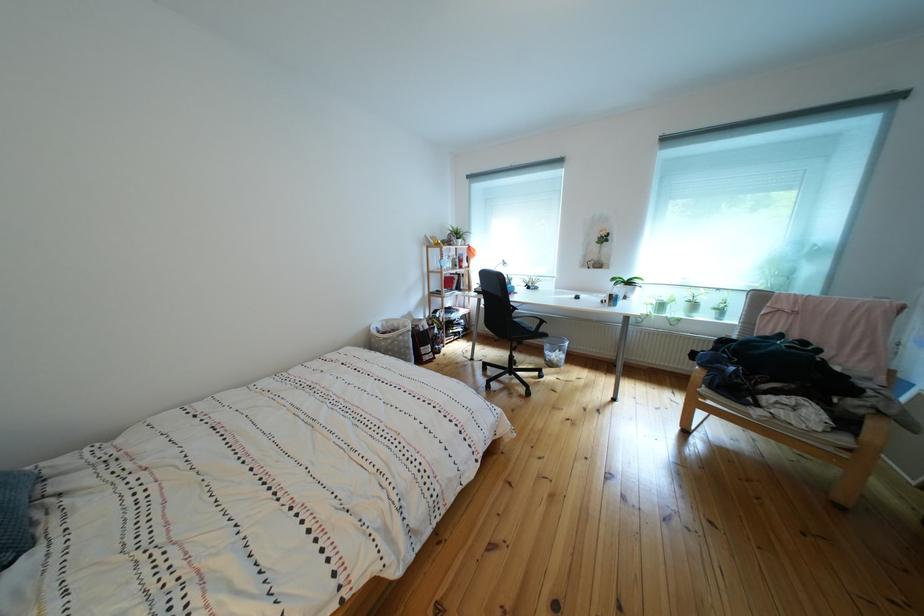
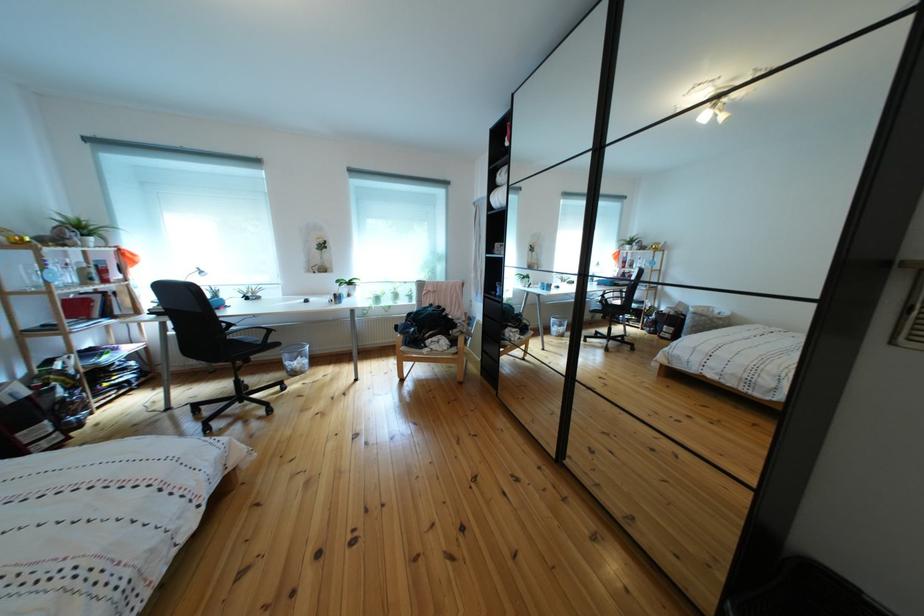
Question: How did the camera likely rotate?

Choices:
 (A) Left
 (B) Right
 (C) Up
 (D) Down

Answer: (B)